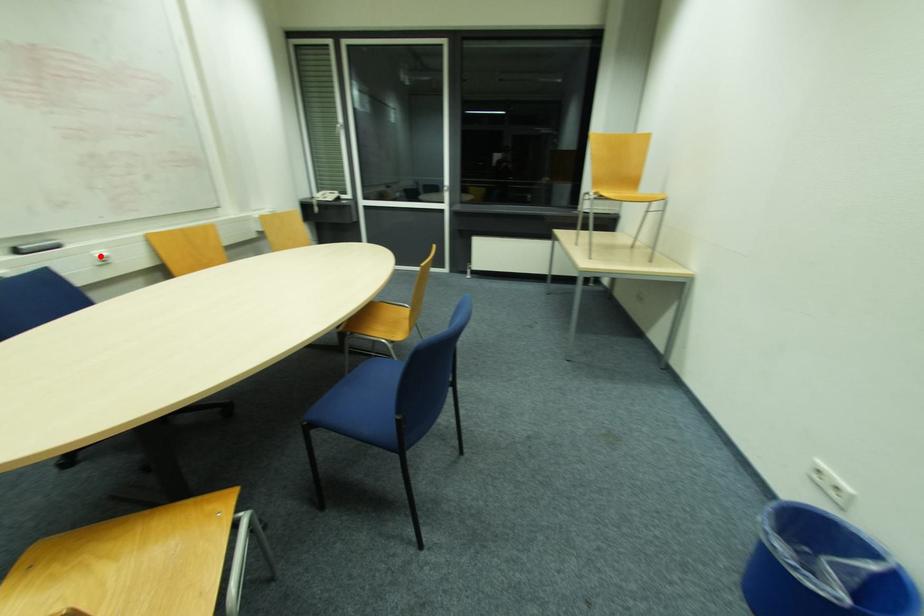
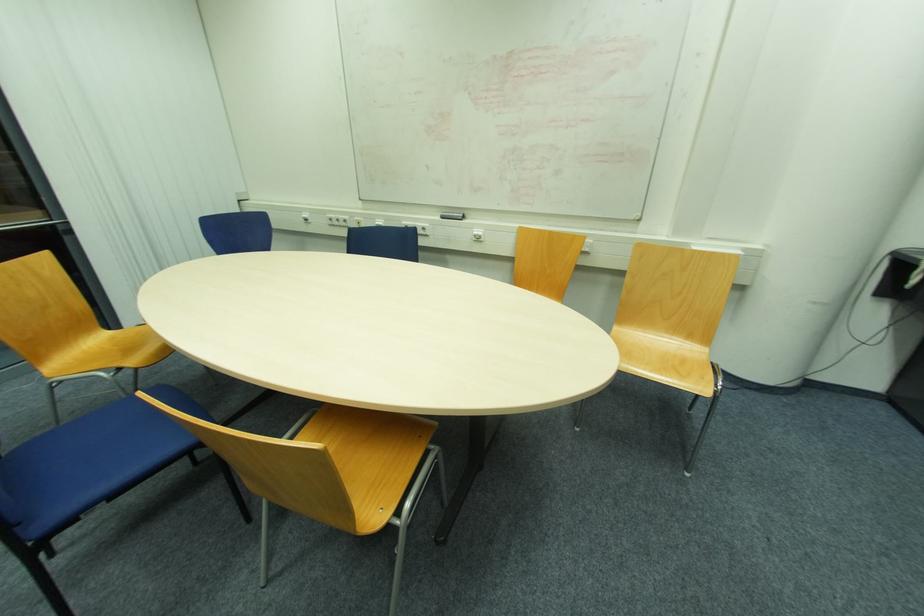
Question: A red point is marked in image1. In image2, is the corresponding 3D point closer to the camera or farther? Reply with the corresponding letter.

Choices:
 (A) The corresponding 3D point is closer.
 (B) The corresponding 3D point is farther.

Answer: (A)